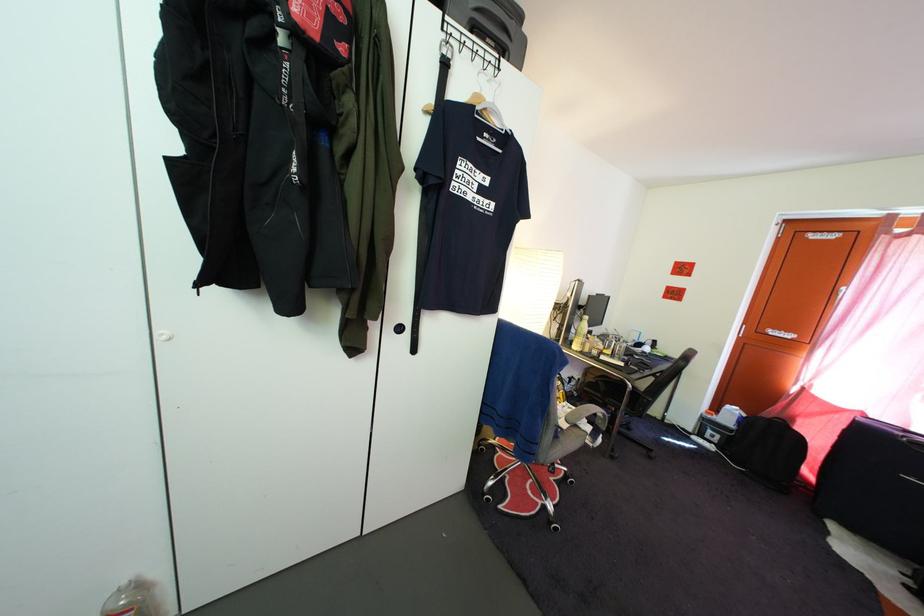
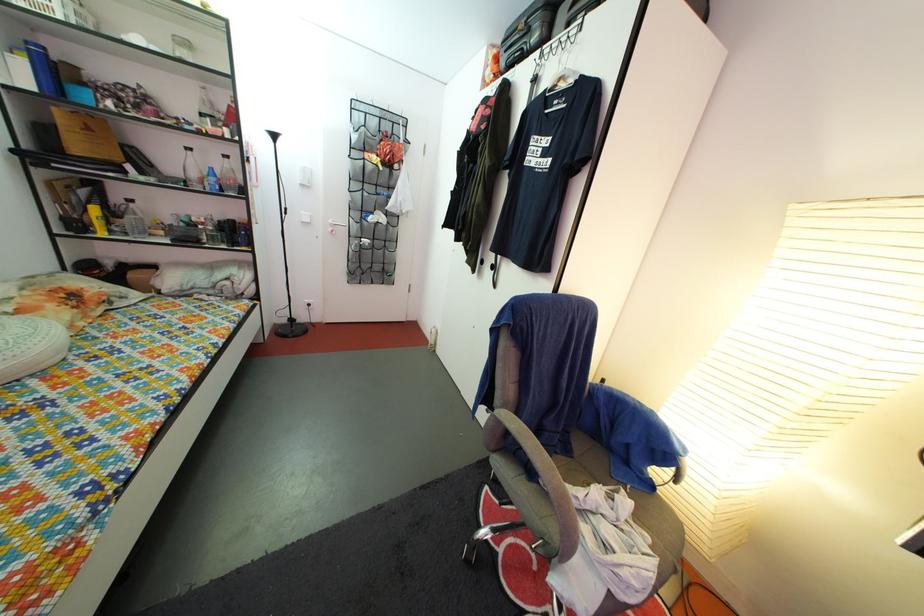
Locate, in the second image, the point that corresponds to [481,37] in the first image.

(578, 31)